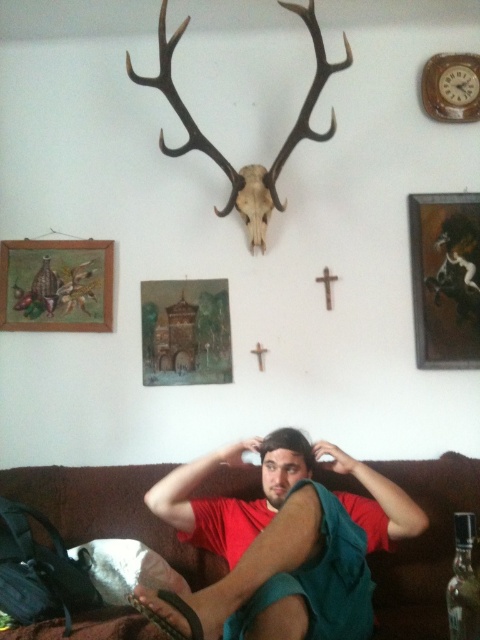
You are a photographer who wants to take a picture of the wooden framed painting at upper right. You have a camera that can focus up to 8 feet. Are you able to take the photo without moving the camera?

The wooden framed painting at upper right and camera are 8.09 feet apart from each other. Since the camera can focus up to 8 feet, the distance is slightly beyond its range. Therefore, you need to move closer or use a different camera with a longer focus range.